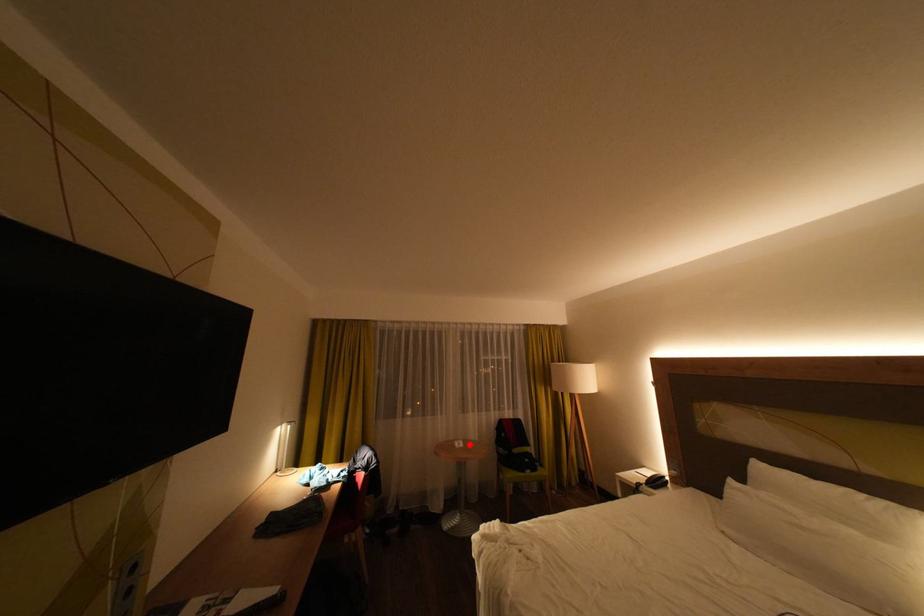
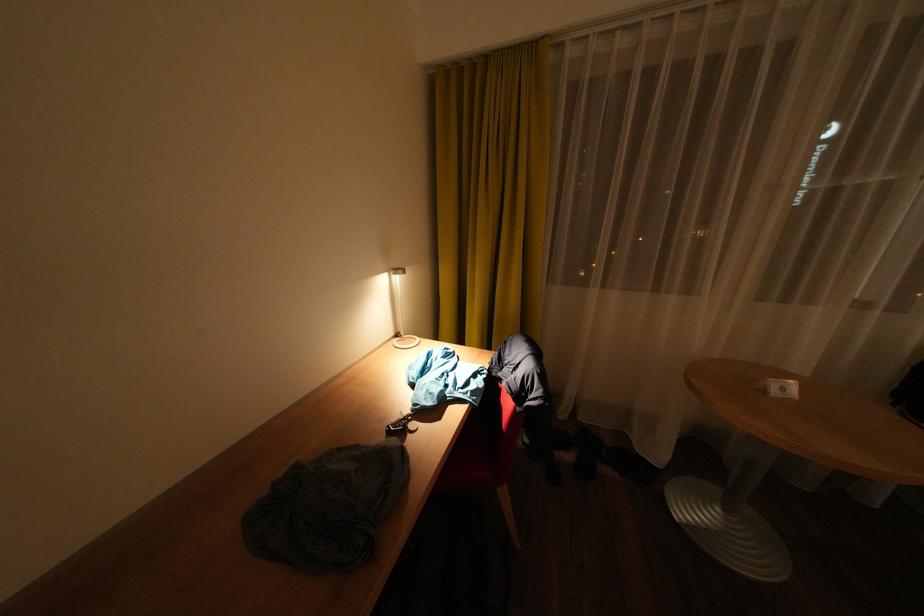
Question: I am providing you with two images of the same scene from different viewpoints. Given a red point in image1, look at the same physical point in image2. Is it:

Choices:
 (A) Closer to the viewpoint
 (B) Farther from the viewpoint

Answer: (A)